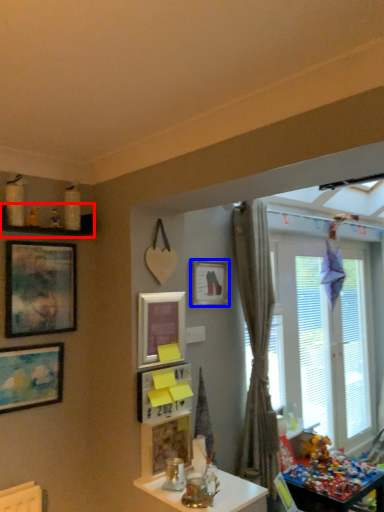
Question: Among these objects, which one is nearest to the camera, shelf (highlighted by a red box) or picture frame (highlighted by a blue box)?

Choices:
 (A) shelf
 (B) picture frame

Answer: (A)